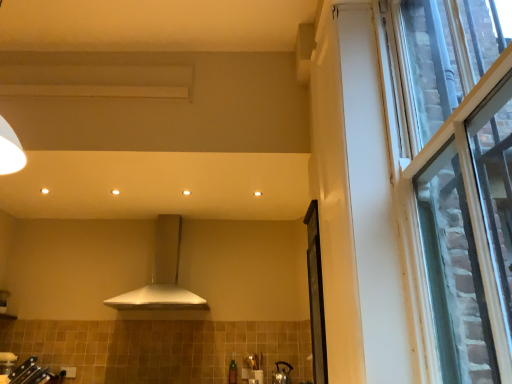
Question: In terms of size, does white matte range hood at center appear bigger or smaller than matte silver kettle at lower center?

Choices:
 (A) big
 (B) small

Answer: (A)

Question: Is white matte range hood at center wider or thinner than matte silver kettle at lower center?

Choices:
 (A) thin
 (B) wide

Answer: (B)

Question: Estimate the real-world distances between objects in this image. Which object is closer to the clear glass window at right?

Choices:
 (A) white matte range hood at center
 (B) transparent glass screen door at right
 (C) matte silver kettle at lower center

Answer: (B)

Question: Which of these objects is positioned farthest from the white matte range hood at center?

Choices:
 (A) transparent glass screen door at right
 (B) matte silver kettle at lower center
 (C) clear glass window at right

Answer: (C)